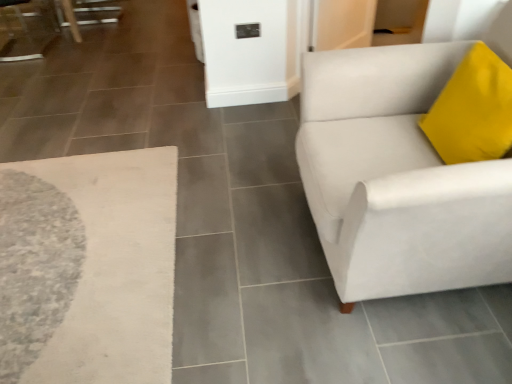
This screenshot has height=384, width=512. What do you see at coordinates (396, 177) in the screenshot?
I see `white leather couch at right` at bounding box center [396, 177].

This screenshot has height=384, width=512. Identify the location of white leather couch at right. (396, 177).

What is the approximate height of white leather couch at right?

38.28 inches.

You are a GUI agent. You are given a task and a screenshot of the screen. Output one action in this format:
    pyautogui.click(x=<x>, y=<y>)
    Task: Click on the white leather couch at right
    The image size is (512, 384).
    Given the screenshot: What is the action you would take?
    pyautogui.click(x=396, y=177)